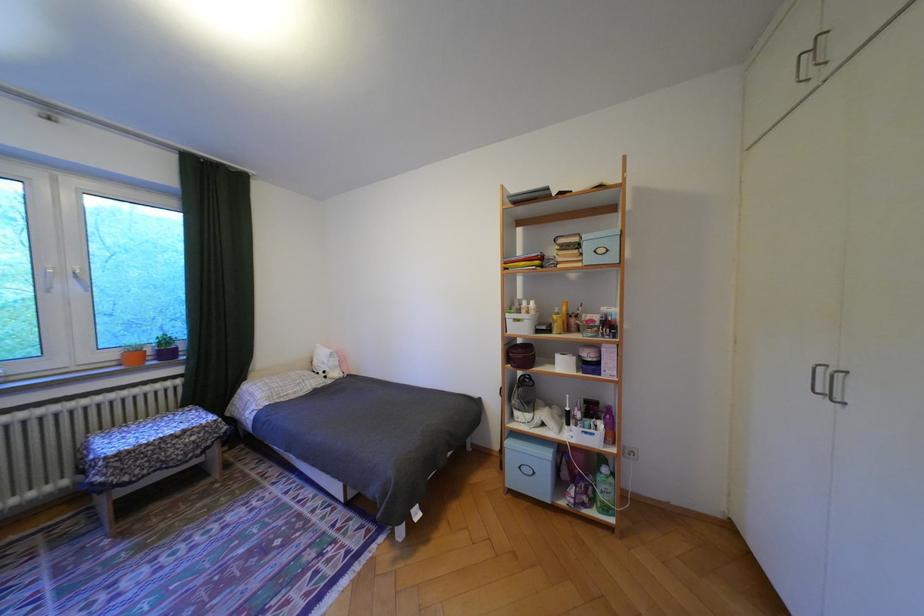
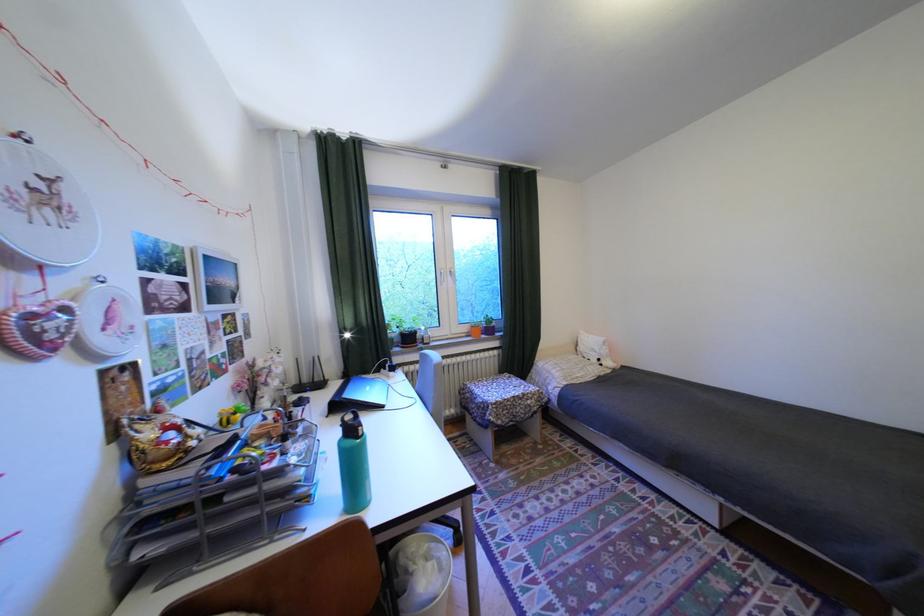
The point at (335, 371) is marked in the first image. Where is the corresponding point in the second image?

(611, 360)